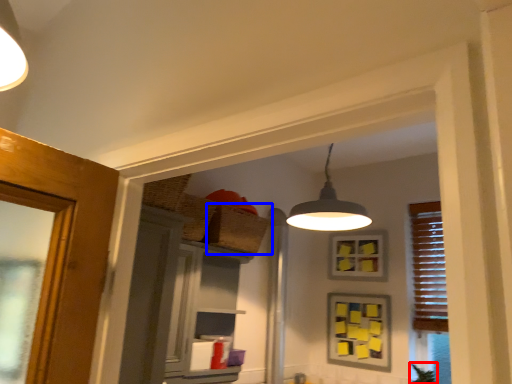
Question: Which point is further to the camera, plant (highlighted by a red box) or basket (highlighted by a blue box)?

Choices:
 (A) plant
 (B) basket

Answer: (A)